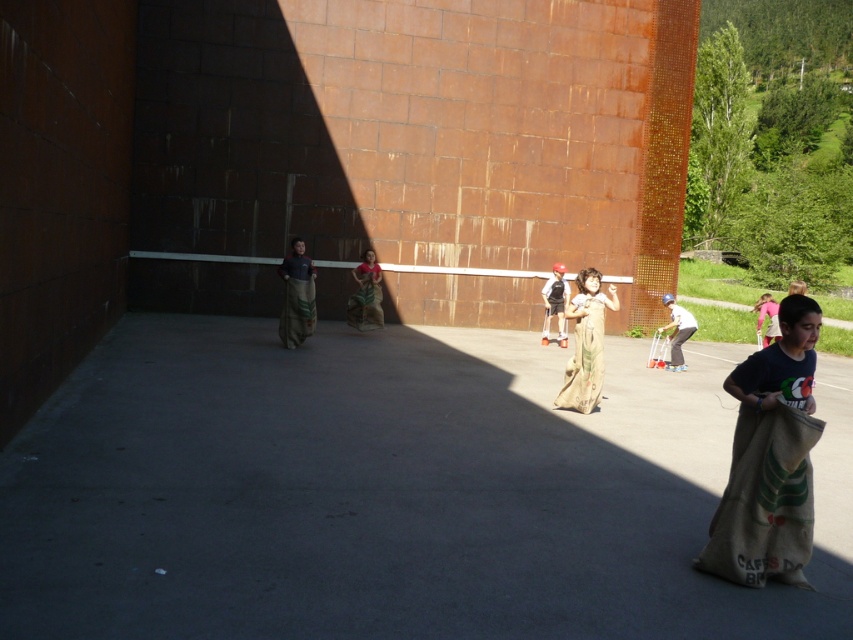
Question: Is brown textured sack at center closer to the viewer compared to matte brown sack at center?

Choices:
 (A) no
 (B) yes

Answer: (B)

Question: In this image, where is brown textured sack at center located relative to pink fabric sack at right?

Choices:
 (A) below
 (B) above

Answer: (A)

Question: Is brown textured sack at center closer to camera compared to brown burlap sack at center?

Choices:
 (A) yes
 (B) no

Answer: (A)

Question: Which of the following is the farthest from the observer?

Choices:
 (A) (567, 381)
 (B) (547, 340)
 (C) (372, 326)
 (D) (289, 317)

Answer: (B)

Question: Among these objects, which one is nearest to the camera?

Choices:
 (A) brown burlap sack at center
 (B) matte brown sack at center
 (C) brown canvas sack at center

Answer: (C)

Question: Which object is positioned closest to the brown burlap sack at center?

Choices:
 (A) matte brown sack at center
 (B) white cotton sack at center
 (C) brown canvas sack at center
 (D) brown textured sack at center

Answer: (C)